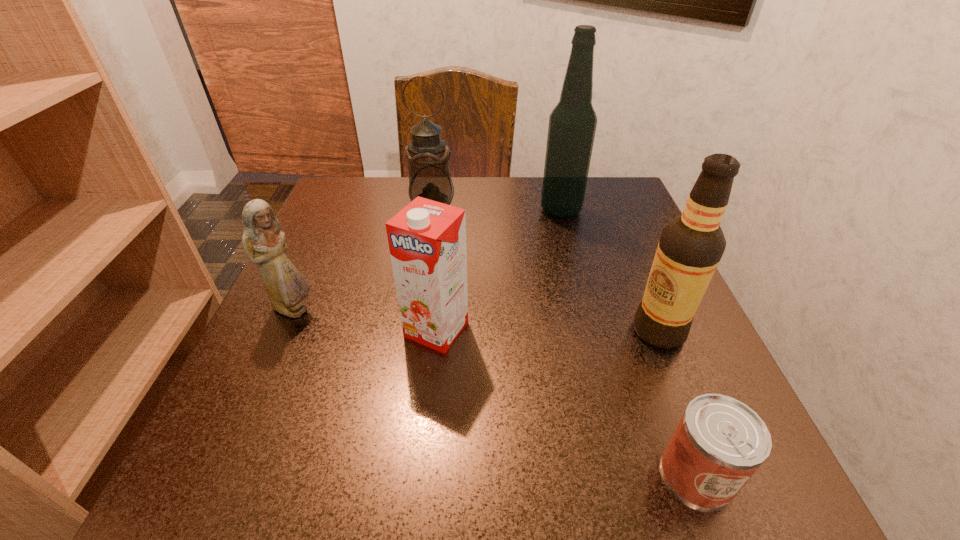
This screenshot has width=960, height=540. In order to click on the tallest object in this screenshot , I will do `click(572, 124)`.

Locate an element on the screen. This screenshot has height=540, width=960. the taller alcohol is located at coordinates click(572, 124).

Where is `the right alcohol`? Image resolution: width=960 pixels, height=540 pixels. the right alcohol is located at coordinates (690, 248).

The image size is (960, 540). I want to click on the shorter alcohol, so click(x=690, y=248).

Find the location of `oil lamp`. oil lamp is located at coordinates (427, 154).

Locate an element on the screen. The width and height of the screenshot is (960, 540). carton is located at coordinates (427, 239).

The image size is (960, 540). I want to click on the leftmost object, so click(263, 240).

You are a GUI agent. You are given a task and a screenshot of the screen. Output one action in this format:
    pyautogui.click(x=<x>, y=<y>)
    Task: Click on the shortest object
    The image size is (960, 540).
    Given the screenshot: What is the action you would take?
    pyautogui.click(x=719, y=443)

You are a GUI agent. You are given a task and a screenshot of the screen. Output one action in this format:
    pyautogui.click(x=<x>, y=<y>)
    Task: Click on the nearest object
    This screenshot has height=540, width=960.
    Given the screenshot: What is the action you would take?
    pyautogui.click(x=719, y=443)

Where is `vacant position located 0.210m on the front of the farther alcohol`? This screenshot has width=960, height=540. vacant position located 0.210m on the front of the farther alcohol is located at coordinates (580, 284).